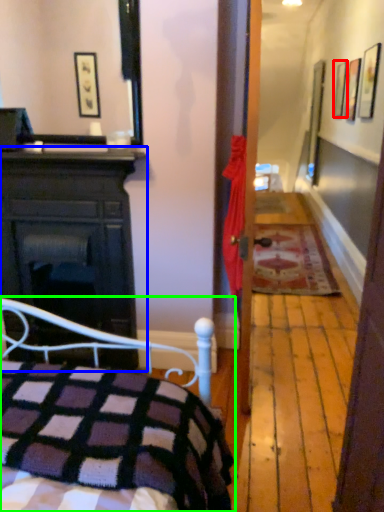
Question: Based on their relative distances, which object is nearer to picture frame (highlighted by a red box)? Choose from cabinetry (highlighted by a blue box) and bed (highlighted by a green box).

Choices:
 (A) cabinetry
 (B) bed

Answer: (A)